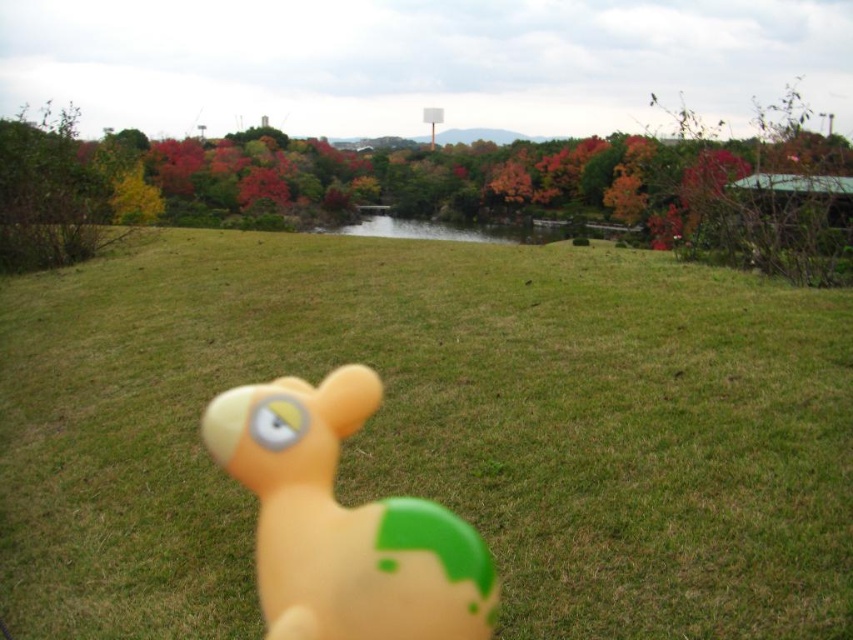
You are a photographer standing in the middle of the grassy field. You want to take a picture of the rubber duck at center and the green leafy bush at left. Which object will appear closer to the camera in the photo?

The rubber duck at center will appear closer to the camera in the photo because it is positioned in front of the green leafy bush at left.

You are standing in the middle of the green grass at center and want to find the rubber duck at center. Which direction should you move to locate it?

The rubber duck at center is on the right side of the green grass at center, so you should move to the right to locate it.

From the picture: You are a child playing in the green grass at center and you see the rubber duck at center. Which object is bigger?

The green grass at center is larger in size compared to the rubber duck at center.